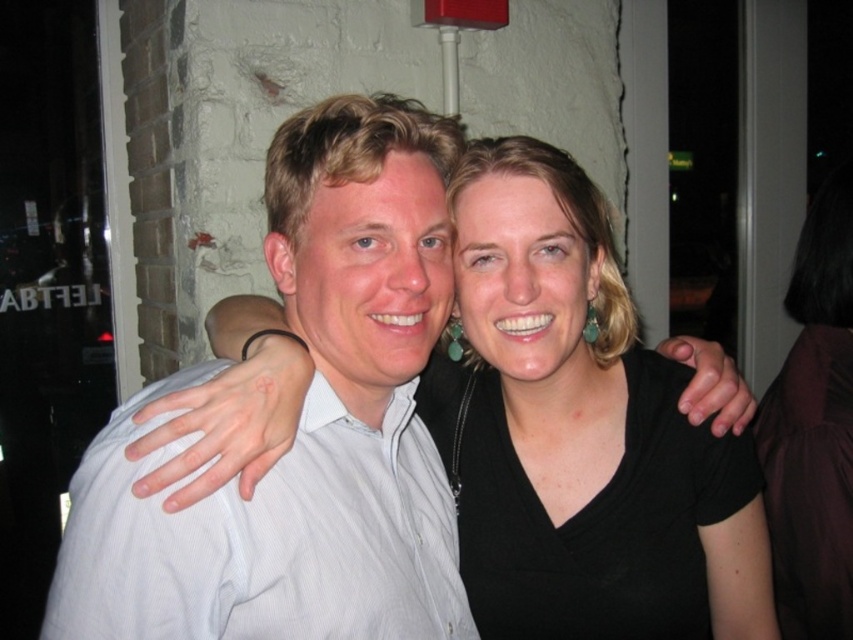
Question: Does white striped shirt at left have a greater width compared to black fabric at right?

Choices:
 (A) yes
 (B) no

Answer: (A)

Question: Which object is positioned closest to the black matte shirt at center?

Choices:
 (A) black fabric at right
 (B) white striped shirt at left

Answer: (B)

Question: Is white striped shirt at left thinner than black matte shirt at center?

Choices:
 (A) yes
 (B) no

Answer: (A)

Question: Is black matte shirt at center further to camera compared to black fabric at right?

Choices:
 (A) no
 (B) yes

Answer: (A)

Question: Which is farther from the black fabric at right?

Choices:
 (A) white striped shirt at left
 (B) black matte shirt at center

Answer: (A)

Question: Which of these objects is positioned closest to the black fabric at right?

Choices:
 (A) black matte shirt at center
 (B) white striped shirt at left

Answer: (A)